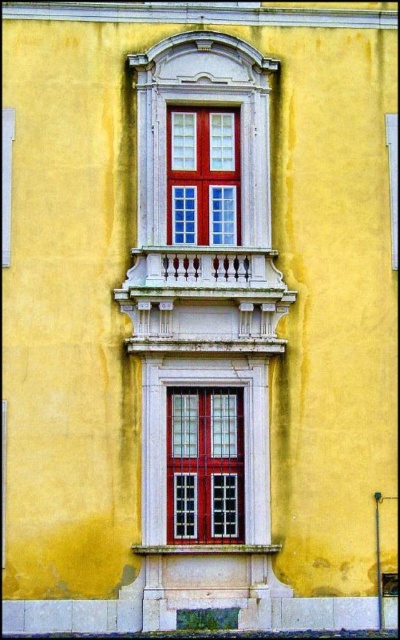
Question: Can you confirm if matte red glass window at center is positioned to the left of matte glass window at center?

Choices:
 (A) yes
 (B) no

Answer: (B)

Question: Can you confirm if matte white window frame at center is wider than matte glass window at center?

Choices:
 (A) no
 (B) yes

Answer: (B)

Question: Estimate the real-world distances between objects in this image. Which object is farther from the matte glass window at center?

Choices:
 (A) matte red glass window at center
 (B) white stone balcony at upper center
 (C) matte white window frame at center

Answer: (A)

Question: Which object appears farthest from the camera in this image?

Choices:
 (A) white stone balcony at upper center
 (B) matte red glass window at center

Answer: (B)

Question: Which object is the farthest from the white stone balcony at upper center?

Choices:
 (A) matte red glass window at center
 (B) matte white window frame at center

Answer: (A)

Question: Observing the image, what is the correct spatial positioning of white stone balcony at upper center in reference to matte glass window at center?

Choices:
 (A) below
 (B) above

Answer: (A)